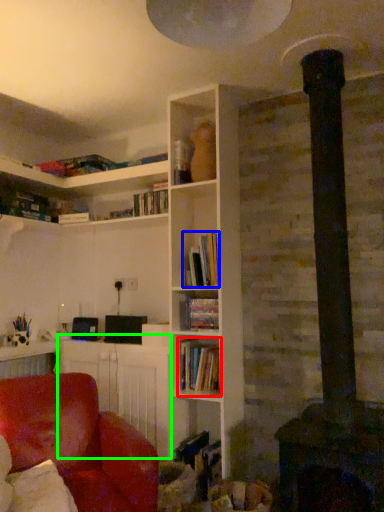
Question: Which object is positioned farthest from book (highlighted by a red box)? Select from book (highlighted by a blue box) and table (highlighted by a green box).

Choices:
 (A) book
 (B) table

Answer: (A)